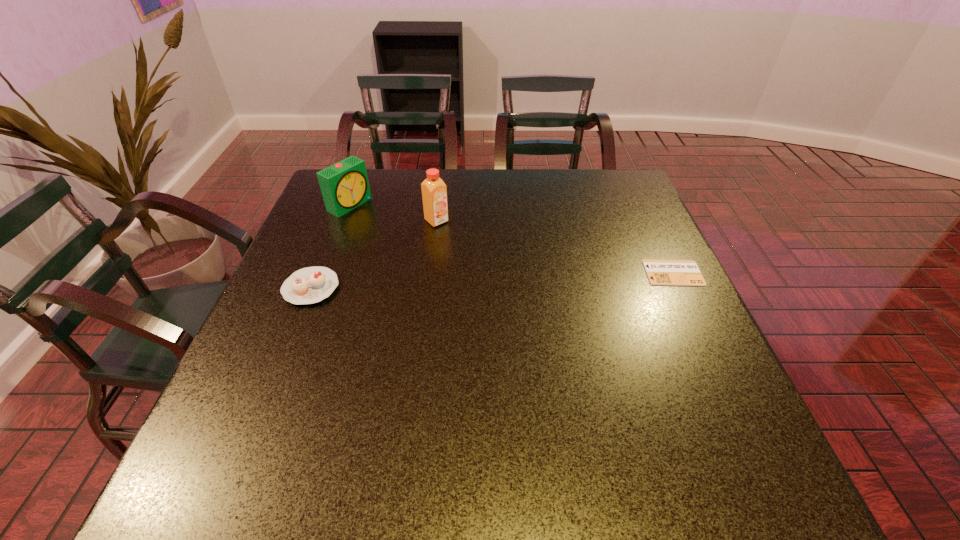
The image size is (960, 540). Find the location of `free space located on the front and back of the orange juice`. free space located on the front and back of the orange juice is located at coordinates (518, 284).

I want to click on free location located on the front-facing side of the alarm clock, so click(405, 235).

Find the location of a particular element. Image resolution: width=960 pixels, height=540 pixels. vacant region located on the front-facing side of the alarm clock is located at coordinates tap(455, 261).

In order to click on vacant area situated 0.400m on the front-facing side of the alarm clock in this screenshot , I will do `click(470, 269)`.

This screenshot has width=960, height=540. In order to click on object that is at the far edge in this screenshot , I will do `click(344, 185)`.

The width and height of the screenshot is (960, 540). What are the coordinates of `cupcake present at the left edge` in the screenshot? It's located at (309, 285).

Where is `alarm clock that is at the left edge`? The image size is (960, 540). alarm clock that is at the left edge is located at coordinates (344, 185).

Where is `object positioned at the right edge`? object positioned at the right edge is located at coordinates (660, 272).

Find the location of a particular element. Image resolution: width=960 pixels, height=540 pixels. object at the far left corner is located at coordinates (344, 185).

In the image, there is a desktop. Identify the location of vacant space at the far edge. (571, 197).